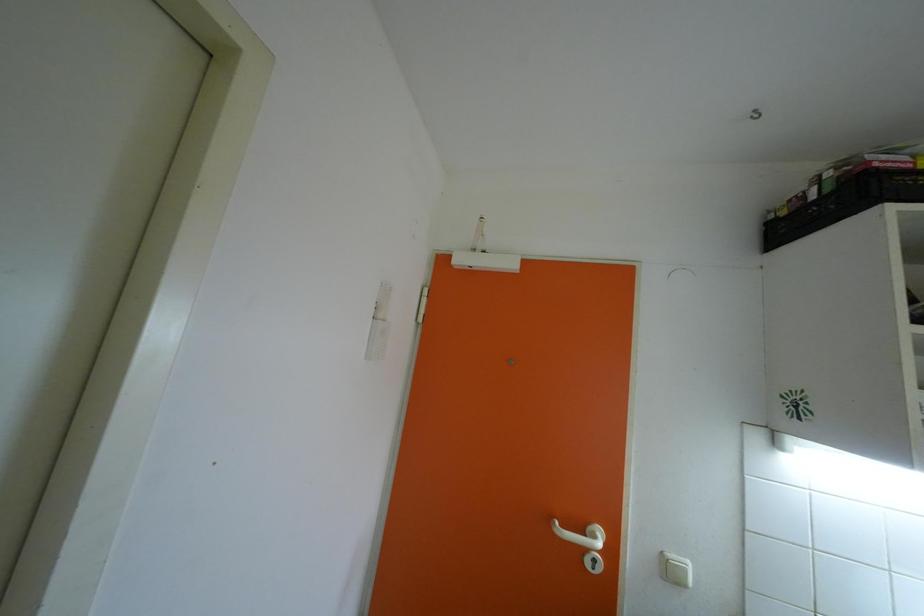
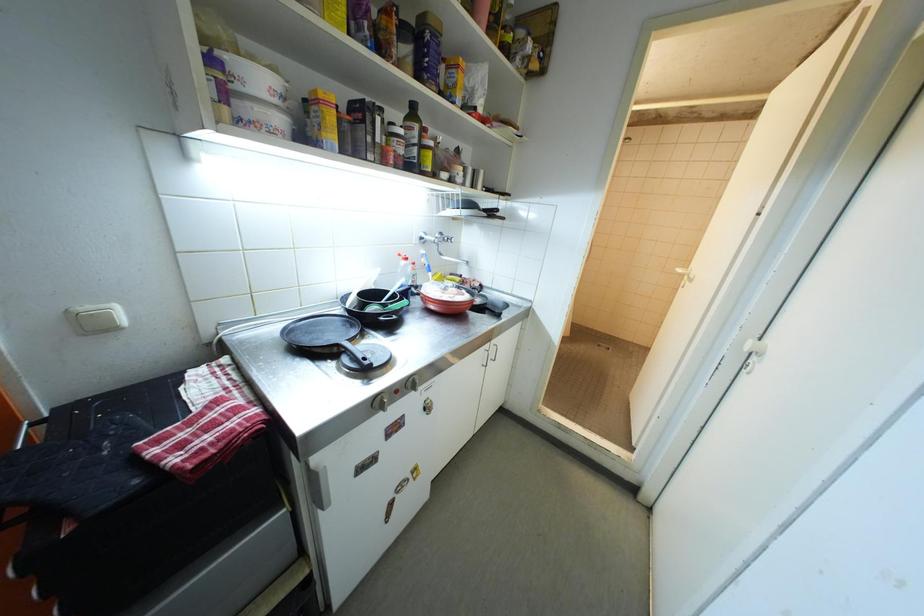
How did the camera likely rotate?

The camera's rotation is toward right-down.